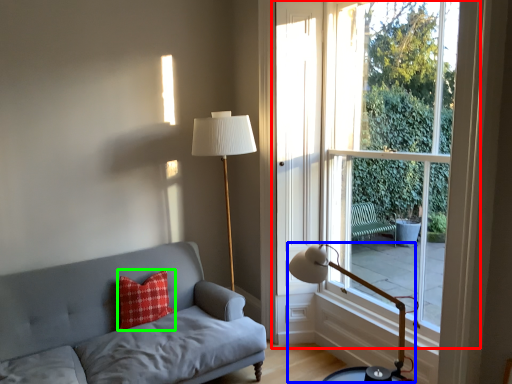
Question: Estimate the real-world distances between objects in this image. Which object is closer to window (highlighted by a red box), table lamp (highlighted by a blue box) or pillow (highlighted by a green box)?

Choices:
 (A) table lamp
 (B) pillow

Answer: (A)